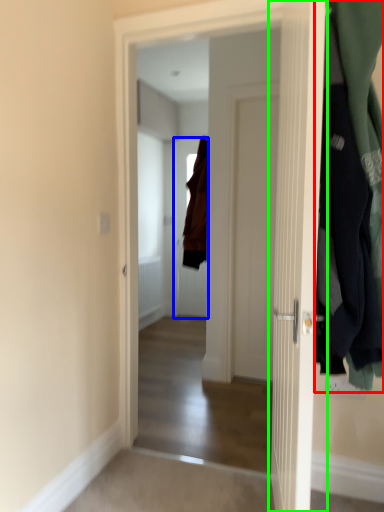
Question: Based on their relative distances, which object is farther from closet (highlighted by a red box)? Choose from door (highlighted by a blue box) and door (highlighted by a green box).

Choices:
 (A) door
 (B) door

Answer: (A)